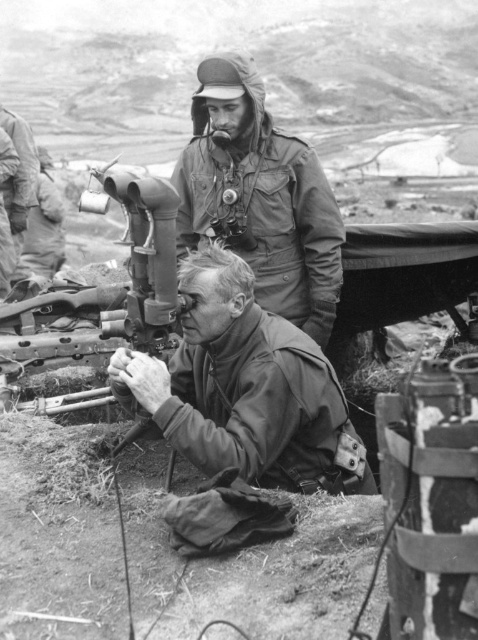
What is located at the coordinates point (246, 388) in the image?

The matte green uniform at center is located at point (246, 388).

You are a soldier in this wartime scene. You need to move from your current position to the communication device being operated by the seated man. Which point, point 1 at coordinates (304, 438) or point 2 at coordinates (30, 275), is closer to the communication device?

Point 1 at coordinates (304, 438) is closer to the communication device because it is closer to the viewer than point 2 at coordinates (30, 275).

Based on the scene described, which soldier is positioned lower in the image, the one in the matte green uniform at center or the one in the matte green uniform at upper center?

The matte green uniform at center is located below the matte green uniform at upper center, so the soldier in the matte green uniform at center is positioned lower in the image.